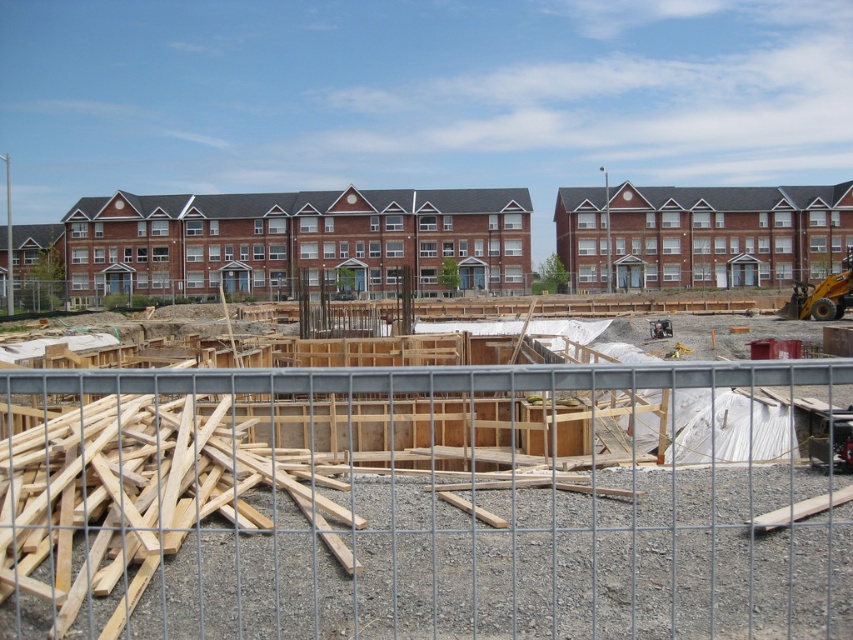
You are standing at the center of the construction site. There is a gray metal fence at center. Where is the gray metal fence located relative to the point with coordinates point (422, 504)?

The gray metal fence at center is located exactly at the point with coordinates point (422, 504).

You are a construction worker who needs to transport materials from the gray metal fence at center to the brick building at center. Considering their sizes, which object requires more space to maneuver around?

The brick building at center requires more space to maneuver around because its width is greater than the gray metal fence at center.